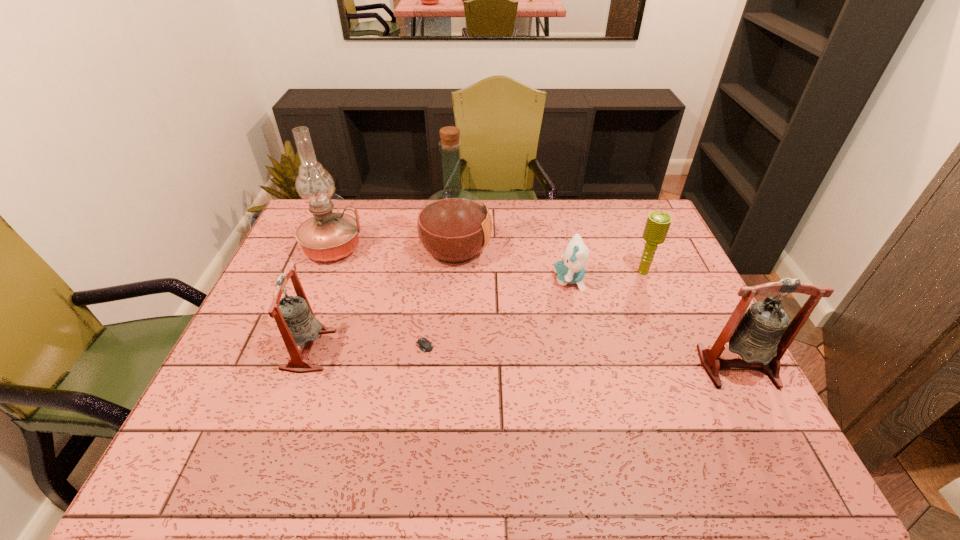
At what (x,y) coordinates should I click in order to perform the action: click on blank space at the right edge of the desktop. Please return your answer as a coordinate pair (x, y). The width and height of the screenshot is (960, 540). Looking at the image, I should click on (684, 345).

In the image, there is a desktop. Where is `vacant space at the near left corner`? The width and height of the screenshot is (960, 540). vacant space at the near left corner is located at coordinates (219, 394).

Locate an element on the screen. vacant area between the oil lamp and the microphone is located at coordinates (488, 260).

I want to click on vacant point located between the fifth object from left to right and the liquor, so click(x=513, y=264).

Where is `free space between the sixth object from left to right and the second shortest object`? The height and width of the screenshot is (540, 960). free space between the sixth object from left to right and the second shortest object is located at coordinates (606, 276).

Locate an element on the screen. This screenshot has height=540, width=960. free space that is in between the second object from right to left and the shortest object is located at coordinates (532, 305).

At what (x,y) coordinates should I click in order to perform the action: click on unoccupied area between the left bell and the fifth object from left to right. Please return your answer as a coordinate pair (x, y). Looking at the image, I should click on (439, 315).

You are a GUI agent. You are given a task and a screenshot of the screen. Output one action in this format:
    pyautogui.click(x=<x>, y=<y>)
    Task: Click on the free space between the microphone and the oil lamp
    The image size is (960, 540).
    Given the screenshot: What is the action you would take?
    pyautogui.click(x=488, y=260)

You are a GUI agent. You are given a task and a screenshot of the screen. Output one action in this format:
    pyautogui.click(x=<x>, y=<y>)
    Task: Click on the free space between the fifth object from left to right and the shorter bell
    The height and width of the screenshot is (540, 960).
    Given the screenshot: What is the action you would take?
    pyautogui.click(x=439, y=315)

At what (x,y) coordinates should I click in order to perform the action: click on vacant region between the third object from right to left and the right bell. Please return your answer as a coordinate pair (x, y). This screenshot has height=540, width=960. Looking at the image, I should click on (654, 323).